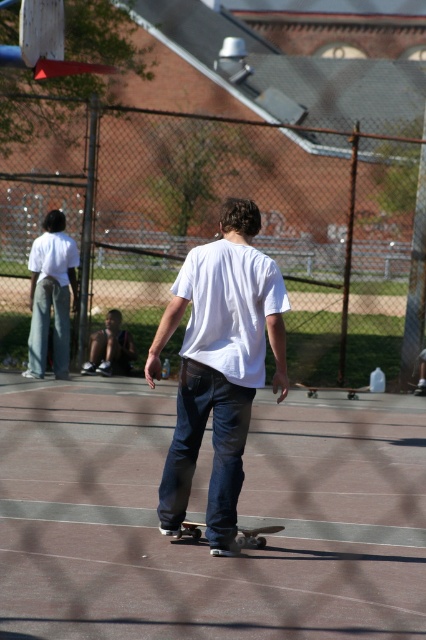
From the picture: Can you confirm if wooden skateboard at center is positioned above black matte skateboard at center?

No, wooden skateboard at center is not above black matte skateboard at center.

Can you confirm if wooden skateboard at center is positioned to the right of black matte skateboard at center?

In fact, wooden skateboard at center is to the left of black matte skateboard at center.

Where is `wooden skateboard at center`? Image resolution: width=426 pixels, height=640 pixels. wooden skateboard at center is located at coordinates (255, 536).

Which is more to the left, white matte shirt at center or white cotton shirt at left?

From the viewer's perspective, white cotton shirt at left appears more on the left side.

The image size is (426, 640). I want to click on white matte shirt at center, so click(x=218, y=365).

Does point (172, 326) come behind point (60, 301)?

No, (172, 326) is closer to viewer.

The width and height of the screenshot is (426, 640). Identify the location of white matte shirt at center. (218, 365).

Who is positioned more to the left, white cotton shirt at left or black matte skateboard at center?

white cotton shirt at left

Is point (57, 307) less distant than point (296, 381)?

Yes, point (57, 307) is in front of point (296, 381).

The width and height of the screenshot is (426, 640). I want to click on white cotton shirt at left, so click(51, 296).